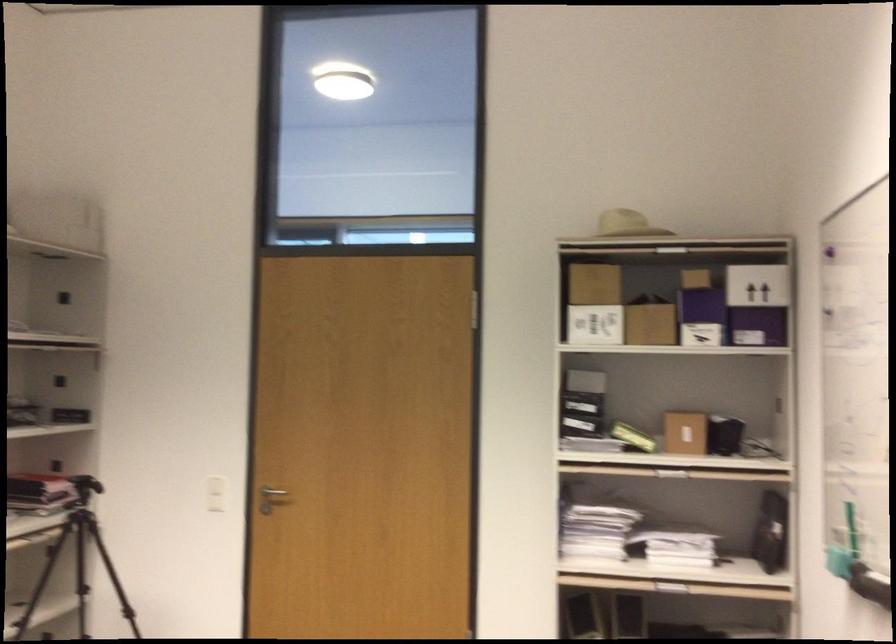
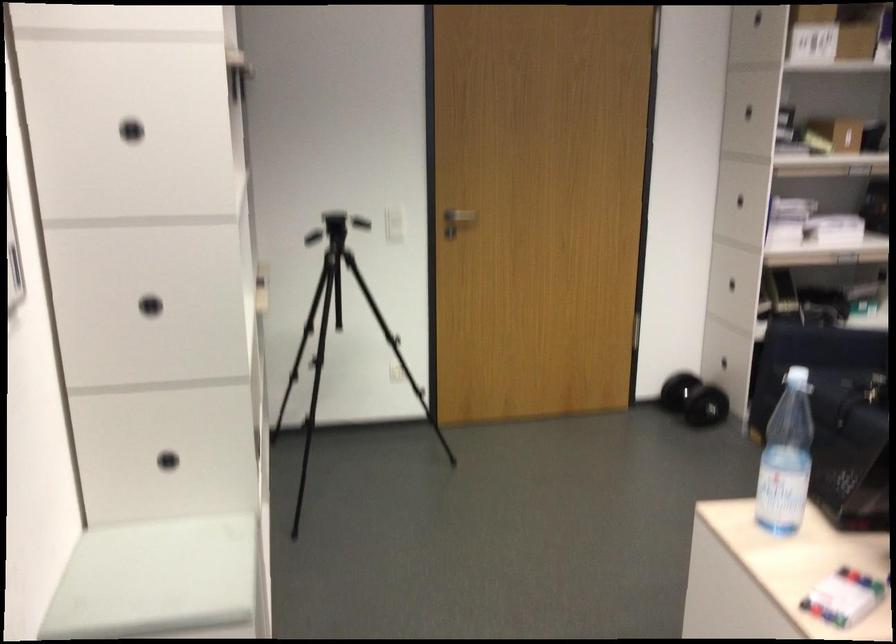
In the second image, find the point that corresponds to (581,395) in the first image.

(747, 111)